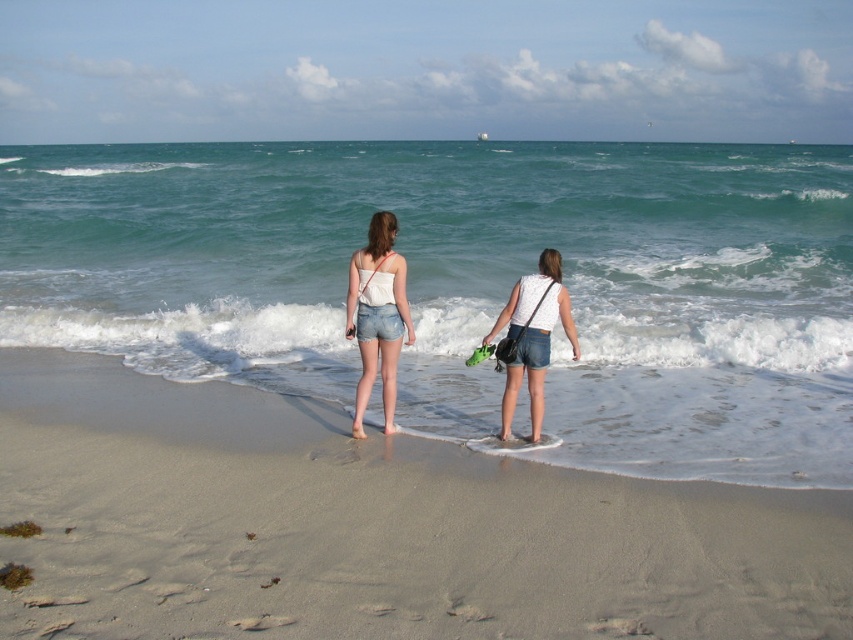
Question: Considering the relative positions of greenish-blue water at center and smooth sand at lower center in the image provided, where is greenish-blue water at center located with respect to smooth sand at lower center?

Choices:
 (A) above
 (B) below

Answer: (A)

Question: Which object is farther from the camera taking this photo?

Choices:
 (A) smooth sand at lower center
 (B) white matte shorts at center
 (C) greenish-blue water at center

Answer: (C)

Question: Can you confirm if matte white tank top at center is smaller than white matte shorts at center?

Choices:
 (A) no
 (B) yes

Answer: (A)

Question: Among these objects, which one is farthest from the camera?

Choices:
 (A) smooth sand at lower center
 (B) greenish-blue water at center
 (C) white matte shorts at center

Answer: (B)

Question: Which point appears farthest from the camera in this image?

Choices:
 (A) (96, 572)
 (B) (511, 324)

Answer: (B)

Question: Is greenish-blue water at center smaller than smooth sand at lower center?

Choices:
 (A) yes
 (B) no

Answer: (B)